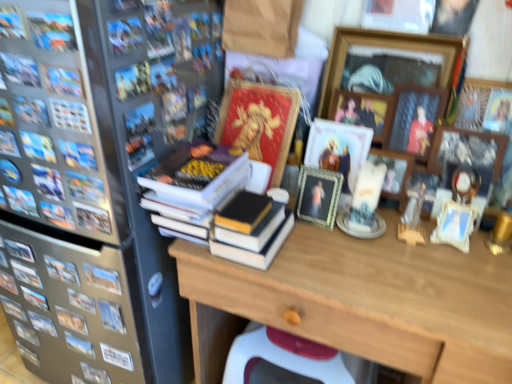
Question: Is wooden desk at center bigger than wooden picture frame at upper right, which is the 2th picture frame from right to left?

Choices:
 (A) yes
 (B) no

Answer: (A)

Question: From a real-world perspective, is wooden desk at center on wooden picture frame at upper right, which is the 2th picture frame from right to left?

Choices:
 (A) yes
 (B) no

Answer: (B)

Question: Considering the relative sizes of wooden desk at center and wooden picture frame at upper right, which is the 2th picture frame from right to left, in the image provided, is wooden desk at center wider than wooden picture frame at upper right, which is the 2th picture frame from right to left,?

Choices:
 (A) yes
 (B) no

Answer: (A)

Question: Is wooden desk at center shorter than wooden picture frame at upper right, which is the 2th picture frame from right to left?

Choices:
 (A) no
 (B) yes

Answer: (A)

Question: From a real-world perspective, is wooden desk at center under wooden picture frame at upper right, arranged as the 4th picture frame when viewed from the left?

Choices:
 (A) no
 (B) yes

Answer: (B)

Question: Would you say wooden desk at center is inside or outside hardcover book at left, acting as the 1th book starting from the left?

Choices:
 (A) inside
 (B) outside

Answer: (B)

Question: From a real-world perspective, is wooden desk at center above or below hardcover book at left, placed as the first book when sorted from bottom to top?

Choices:
 (A) below
 (B) above

Answer: (A)

Question: Looking at their shapes, would you say wooden desk at center is wider or thinner than hardcover book at left, the 4th book in the right-to-left sequence?

Choices:
 (A) wide
 (B) thin

Answer: (A)

Question: Is wooden desk at center to the left or to the right of hardcover book at left, placed as the first book when sorted from bottom to top, in the image?

Choices:
 (A) left
 (B) right

Answer: (B)

Question: In the image, is metallic gray refrigerator at left on the left side or the right side of wooden picture frame at upper right, the fifth picture frame in the left-to-right sequence?

Choices:
 (A) right
 (B) left

Answer: (B)

Question: Relative to wooden picture frame at upper right, the fifth picture frame in the left-to-right sequence, is metallic gray refrigerator at left in front or behind?

Choices:
 (A) front
 (B) behind

Answer: (A)

Question: Is metallic gray refrigerator at left inside the boundaries of wooden picture frame at upper right, the fifth picture frame in the left-to-right sequence, or outside?

Choices:
 (A) inside
 (B) outside

Answer: (B)

Question: From the image's perspective, is metallic gray refrigerator at left positioned above or below wooden picture frame at upper right, which is the 1th picture frame from right to left?

Choices:
 (A) below
 (B) above

Answer: (A)

Question: Considering the positions of green textured frame at center, placed as the first picture frame when sorted from left to right, and wooden picture frame at upper center, which is counted as the fourth picture frame, starting from the right, in the image, is green textured frame at center, placed as the first picture frame when sorted from left to right, taller or shorter than wooden picture frame at upper center, which is counted as the fourth picture frame, starting from the right,?

Choices:
 (A) tall
 (B) short

Answer: (A)

Question: From the image's perspective, is green textured frame at center, placed as the first picture frame when sorted from left to right, above or below wooden picture frame at upper center, arranged as the second picture frame when viewed from the left?

Choices:
 (A) above
 (B) below

Answer: (B)